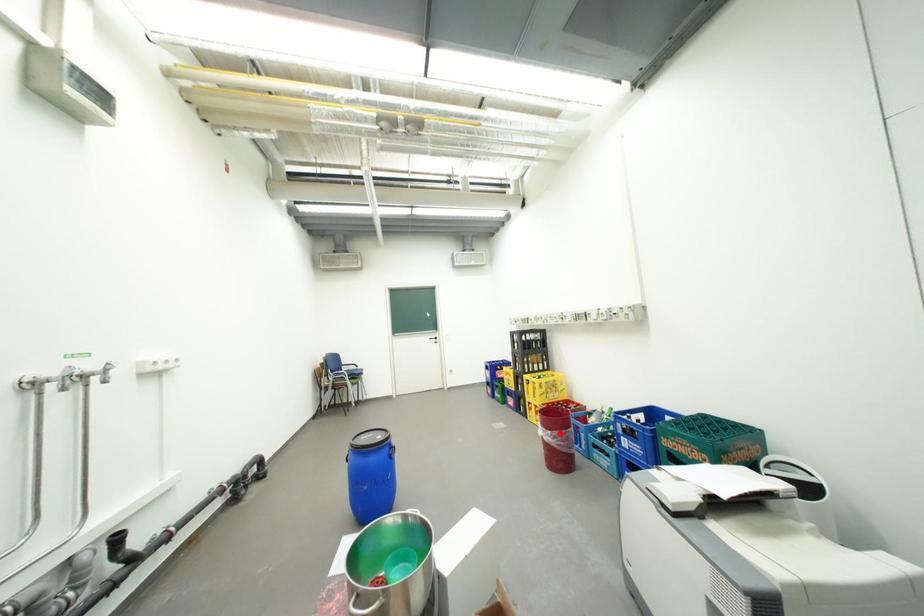
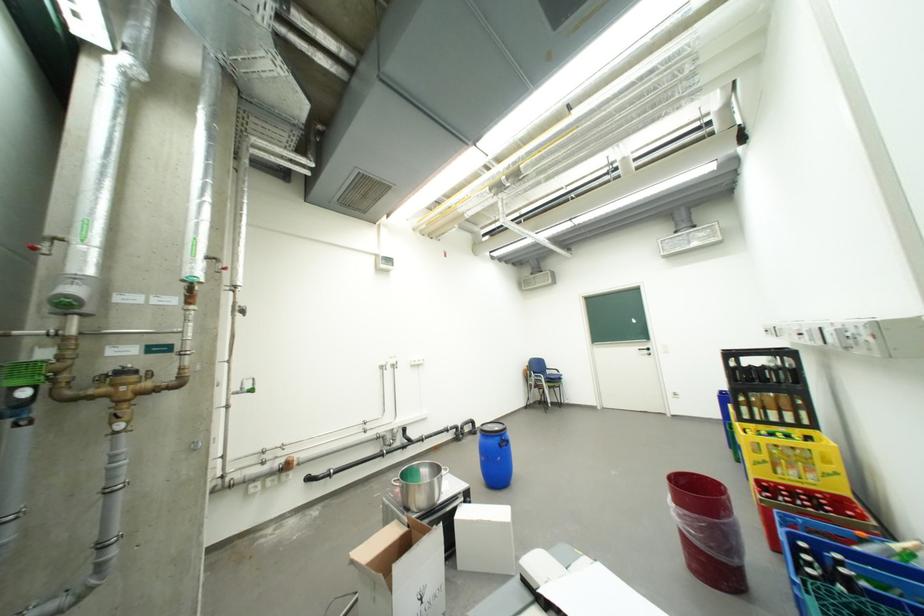
Question: I am providing you with two images of the same scene from different viewpoints. A red point is marked on the first image. At the location where the point appears in image 1, is it still visible in image 2?

Choices:
 (A) Yes
 (B) No

Answer: (A)